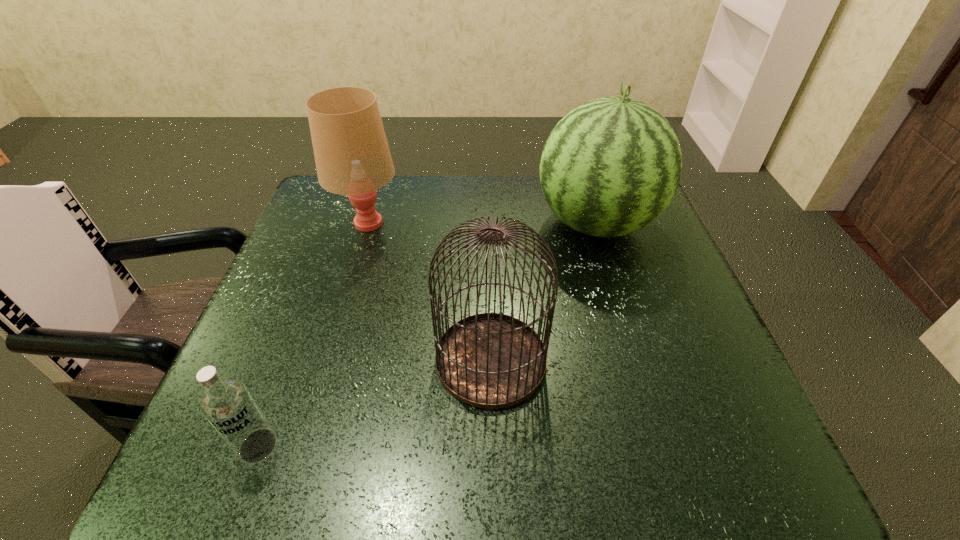
This screenshot has width=960, height=540. In order to click on object that can be found as the third closest to the third farthest object in this screenshot , I will do `click(352, 156)`.

The height and width of the screenshot is (540, 960). I want to click on object that stands as the closest to the lampshade, so click(x=490, y=360).

This screenshot has height=540, width=960. What are the coordinates of `free spot that satisfies the following two spatial constraints: 1. on the back side of the birdcage; 2. on the right side of the rightmost object` in the screenshot? It's located at (488, 224).

The height and width of the screenshot is (540, 960). Find the location of `blank space that satisfies the following two spatial constraints: 1. on the back side of the third farthest object; 2. on the left side of the rightmost object`. blank space that satisfies the following two spatial constraints: 1. on the back side of the third farthest object; 2. on the left side of the rightmost object is located at coordinates (488, 224).

You are a GUI agent. You are given a task and a screenshot of the screen. Output one action in this format:
    pyautogui.click(x=<x>, y=<y>)
    Task: Click on the vacant space that satisfies the following two spatial constraints: 1. on the front side of the birdcage; 2. on the left side of the lampshade
    The height and width of the screenshot is (540, 960).
    Given the screenshot: What is the action you would take?
    pyautogui.click(x=326, y=360)